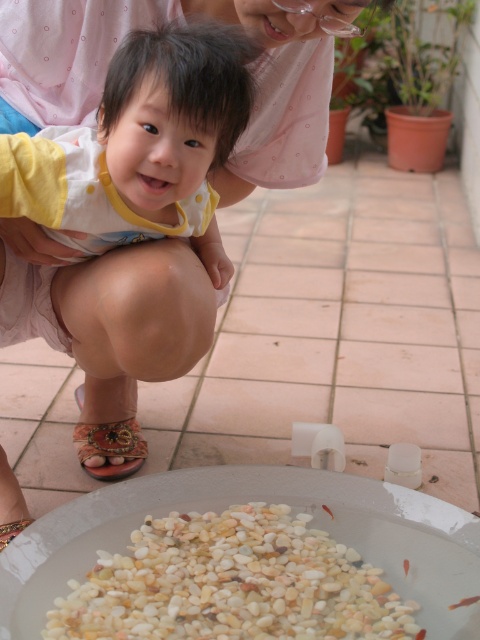
Consider the image. You are standing on the tiled patio and see the white pebbles at bottom and the leather floral sandal at lower left. Which object is closer to you?

The white pebbles at bottom are closer to you because they are in front of the leather floral sandal at lower left.